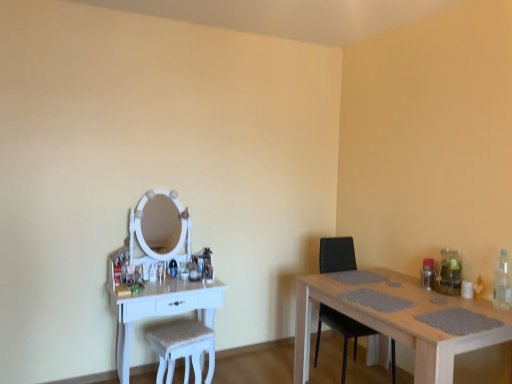
Question: Is white fabric swivel chair at center wider than clear plastic bottle at right?

Choices:
 (A) no
 (B) yes

Answer: (B)

Question: Is white fabric swivel chair at center oriented away from clear plastic bottle at right?

Choices:
 (A) no
 (B) yes

Answer: (A)

Question: Can you confirm if white fabric swivel chair at center is shorter than clear plastic bottle at right?

Choices:
 (A) yes
 (B) no

Answer: (B)

Question: Is white fabric swivel chair at center behind clear plastic bottle at right?

Choices:
 (A) no
 (B) yes

Answer: (B)

Question: From a real-world perspective, is white fabric swivel chair at center below clear plastic bottle at right?

Choices:
 (A) no
 (B) yes

Answer: (B)

Question: Does white fabric swivel chair at center touch clear plastic bottle at right?

Choices:
 (A) no
 (B) yes

Answer: (A)

Question: From the image's perspective, would you say light brown wooden table at right, which is the second table in left-to-right order, is shown under white wood table at left, which is the second table in right-to-left order?

Choices:
 (A) no
 (B) yes

Answer: (B)

Question: Considering the relative sizes of light brown wooden table at right, the 1th table from the right, and white wood table at left, which is the 1th table in left-to-right order, in the image provided, is light brown wooden table at right, the 1th table from the right, thinner than white wood table at left, which is the 1th table in left-to-right order,?

Choices:
 (A) no
 (B) yes

Answer: (A)

Question: Can you confirm if light brown wooden table at right, which is the second table in left-to-right order, is wider than white wood table at left, which is the 1th table in left-to-right order?

Choices:
 (A) no
 (B) yes

Answer: (B)

Question: Can you confirm if light brown wooden table at right, which is the second table in left-to-right order, is smaller than white wood table at left, which is the 1th table in left-to-right order?

Choices:
 (A) no
 (B) yes

Answer: (A)

Question: Does light brown wooden table at right, which is the second table in left-to-right order, appear on the left side of white wood table at left, which is the second table in right-to-left order?

Choices:
 (A) no
 (B) yes

Answer: (A)

Question: Does light brown wooden table at right, the 1th table from the right, have a larger size compared to white wood table at left, which is the 1th table in left-to-right order?

Choices:
 (A) no
 (B) yes

Answer: (B)

Question: From a real-world perspective, does light brown wooden table at right, the 1th table from the right, stand above clear plastic bottle at right?

Choices:
 (A) no
 (B) yes

Answer: (A)